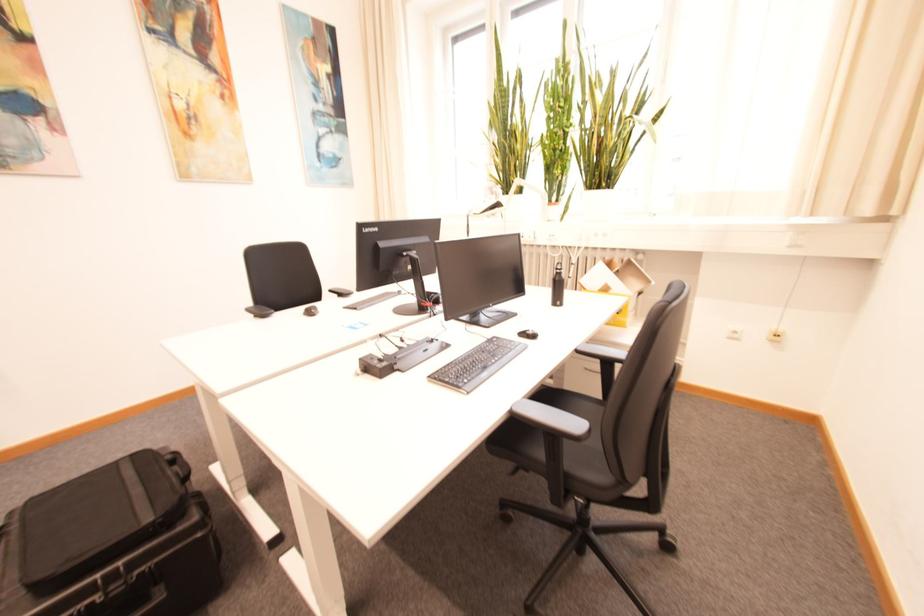
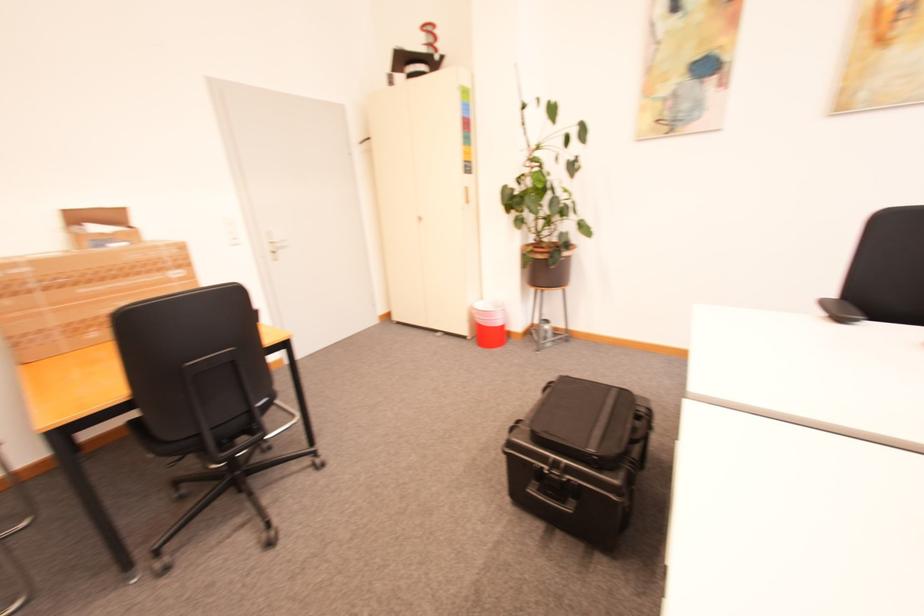
The first image is from the beginning of the video and the second image is from the end. How did the camera likely rotate when shooting the video?

The camera's rotation is toward left-down.